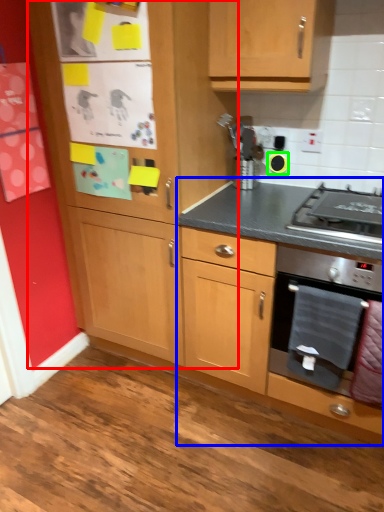
Question: Based on their relative distances, which object is nearer to cabinetry (highlighted by a red box)? Choose from cabinetry (highlighted by a blue box) and appliance (highlighted by a green box).

Choices:
 (A) cabinetry
 (B) appliance

Answer: (A)